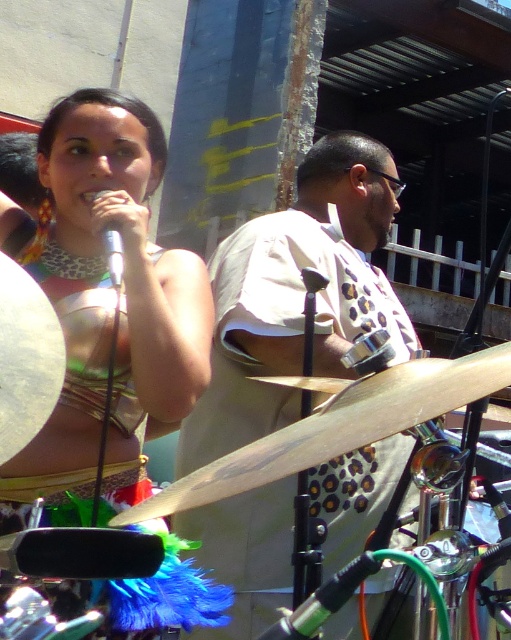
Question: Which point is farther to the camera?

Choices:
 (A) black rubber microphone at center
 (B) white dotted shirt at center
 (C) matte gold necklace at upper left
 (D) silver metallic microphone at upper center

Answer: (B)

Question: Among these points, which one is farthest from the camera?

Choices:
 (A) (295, 627)
 (B) (119, 236)
 (C) (207, 465)
 (D) (109, 493)

Answer: (C)

Question: Does white dotted shirt at center appear on the right side of matte gold necklace at upper left?

Choices:
 (A) no
 (B) yes

Answer: (B)

Question: Among these objects, which one is farthest from the camera?

Choices:
 (A) matte gold necklace at upper left
 (B) black rubber microphone at center
 (C) wooden drum at center
 (D) white dotted shirt at center

Answer: (D)

Question: Does matte gold necklace at upper left have a greater width compared to silver metallic microphone at upper center?

Choices:
 (A) yes
 (B) no

Answer: (A)

Question: Does white dotted shirt at center appear on the left side of matte gold necklace at upper left?

Choices:
 (A) no
 (B) yes

Answer: (A)